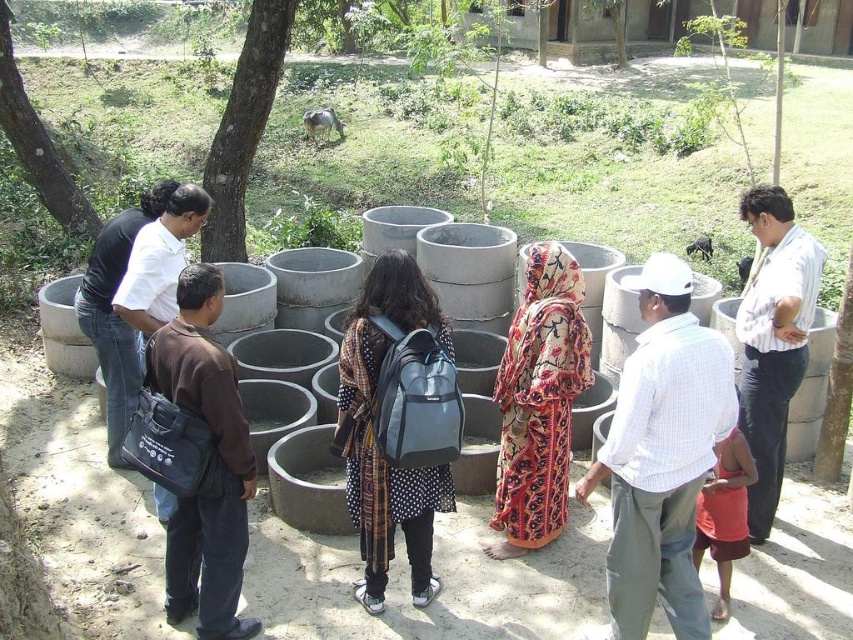
You are standing in the rural area looking at the green rough bark tree at upper center and the green leafy tree at upper left. Which tree is closer to you?

The green rough bark tree at upper center is closer to you because it is in front of the green leafy tree at upper left.

You are a photographer trying to capture both the green rough bark tree at upper center and the green leafy tree at upper left in a single frame. Based on their heights, which tree should you focus on to ensure both are fully visible in your shot?

Since the green rough bark tree at upper center is taller than the green leafy tree at upper left, you should focus on positioning the camera to include the full height of the taller tree, ensuring the shorter one will naturally fit within the frame.

You are attending an outdoor event and notice the printed fabric dress at center and the green leafy tree at upper left. Which object is providing shade to the other?

The green leafy tree at upper left is providing shade to the printed fabric dress at center since the dress is positioned under the tree.